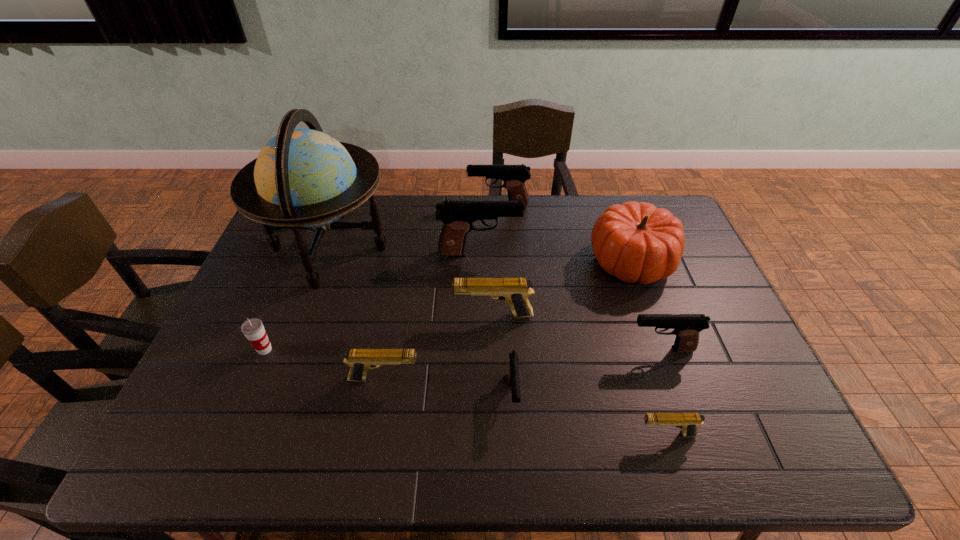
Find the location of a particular element. This screenshot has height=540, width=960. vacant area located at the barrel of the second biggest black pistol is located at coordinates (416, 206).

Where is `blank area located 0.270m at the barrel of the second biggest black pistol`? blank area located 0.270m at the barrel of the second biggest black pistol is located at coordinates (395, 206).

What are the coordinates of `free space located at the barrel of the farthest tan pistol` in the screenshot? It's located at (392, 315).

Where is `vacant area situated at the barrel of the farthest tan pistol`? This screenshot has height=540, width=960. vacant area situated at the barrel of the farthest tan pistol is located at coordinates (420, 315).

The image size is (960, 540). What are the coordinates of `free space located 0.120m at the barrel of the farthest tan pistol` in the screenshot? It's located at (412, 315).

Find the location of `vacant position located at the barrel of the rightmost black pistol`. vacant position located at the barrel of the rightmost black pistol is located at coordinates (485, 349).

You are a GUI agent. You are given a task and a screenshot of the screen. Output one action in this format:
    pyautogui.click(x=<x>, y=<y>)
    Task: Click on the vacant space situated 0.310m at the barrel of the rightmost black pistol
    This screenshot has height=540, width=960.
    Given the screenshot: What is the action you would take?
    pyautogui.click(x=511, y=349)

The width and height of the screenshot is (960, 540). Identify the location of free space located 0.070m at the barrel of the rightmost black pistol. (601, 349).

Identify the location of free location located on the side of the cup with the logo. (405, 350).

Find the location of a particular element. This screenshot has width=960, height=540. free region located at the barrel of the second smallest tan pistol is located at coordinates (471, 379).